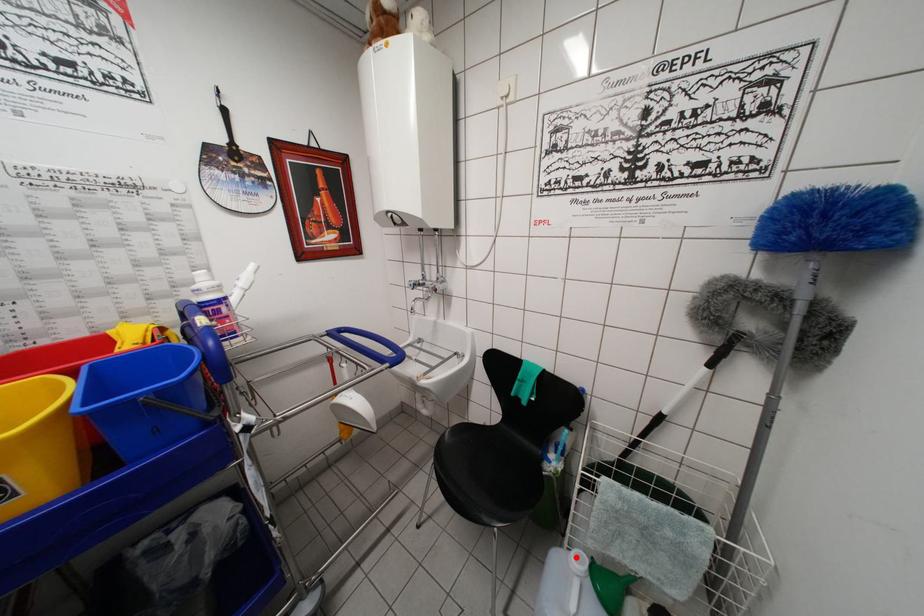
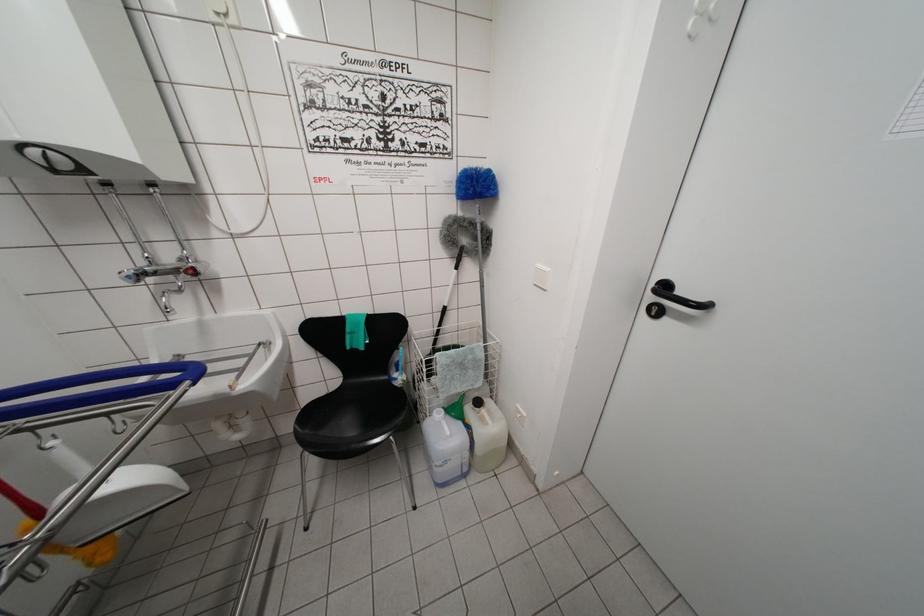
In the second image, find the point that corresponds to the highlighted location in the first image.

(438, 418)